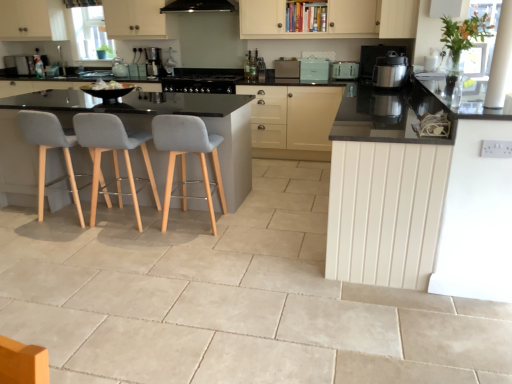
Question: Is point (391, 273) closer or farther from the camera than point (381, 72)?

Choices:
 (A) closer
 (B) farther

Answer: (A)

Question: Visually, is white wood counter at right positioned to the left or to the right of satin silver pressure cooker at right, placed as the first kitchen appliance when sorted from front to back?

Choices:
 (A) right
 (B) left

Answer: (B)

Question: Based on their relative distances, which object is farther from the matte white cabinet at upper right, which ranks as the 1th cabinetry in front-to-back order?

Choices:
 (A) black matte exhaust hood at upper center
 (B) matte black cabinet at center, the 1th cabinetry when ordered from back to front
 (C) grey fabric chair at left, placed as the 1th chair when sorted from left to right
 (D) black glass stove at center, placed as the third appliance when sorted from right to left
 (E) light gray fabric chair at center, acting as the 3th chair starting from the left

Answer: (C)

Question: Considering the real-world distances, which object is closest to the matte teal toaster at center, arranged as the second appliance when viewed from the left?

Choices:
 (A) matte white cabinet at upper right, which is the 2th cabinetry from bottom to top
 (B) black matte exhaust hood at upper center
 (C) black glass stove at center, the first appliance viewed from the left
 (D) satin silver pressure cooker at right, the 2th kitchen appliance viewed from the top
 (E) white wood counter at right

Answer: (C)